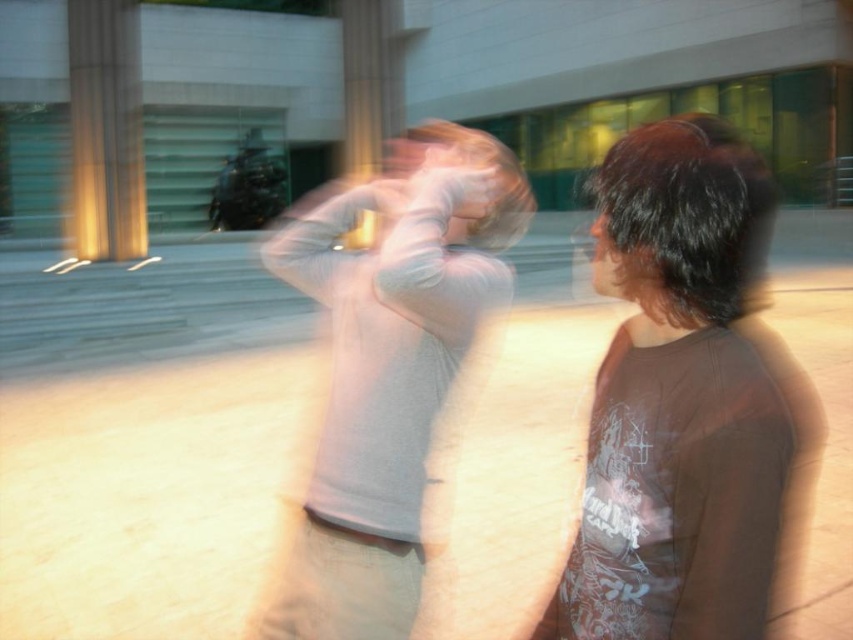
Is point (473, 150) closer to viewer compared to point (136, 234)?

Yes.

Measure the distance between light gray cotton shirt at center and golden polished pillar at left.

light gray cotton shirt at center is 9.96 meters away from golden polished pillar at left.

Locate an element on the screen. The image size is (853, 640). light gray cotton shirt at center is located at coordinates [x=387, y=369].

Does dark brown t-shirt at right appear under light gray cotton shirt at center?

Correct, dark brown t-shirt at right is located below light gray cotton shirt at center.

How far apart are dark brown t-shirt at right and light gray cotton shirt at center?

They are 1.19 meters apart.

Is point (686, 120) farther from viewer compared to point (357, 428)?

That is False.

Where is `dark brown t-shirt at right`? The height and width of the screenshot is (640, 853). dark brown t-shirt at right is located at coordinates (680, 400).

Identify the location of dark brown t-shirt at right. (680, 400).

Between point (762, 568) and point (73, 236), which one is positioned behind?

The point (73, 236) is more distant.

I want to click on dark brown t-shirt at right, so click(x=680, y=400).